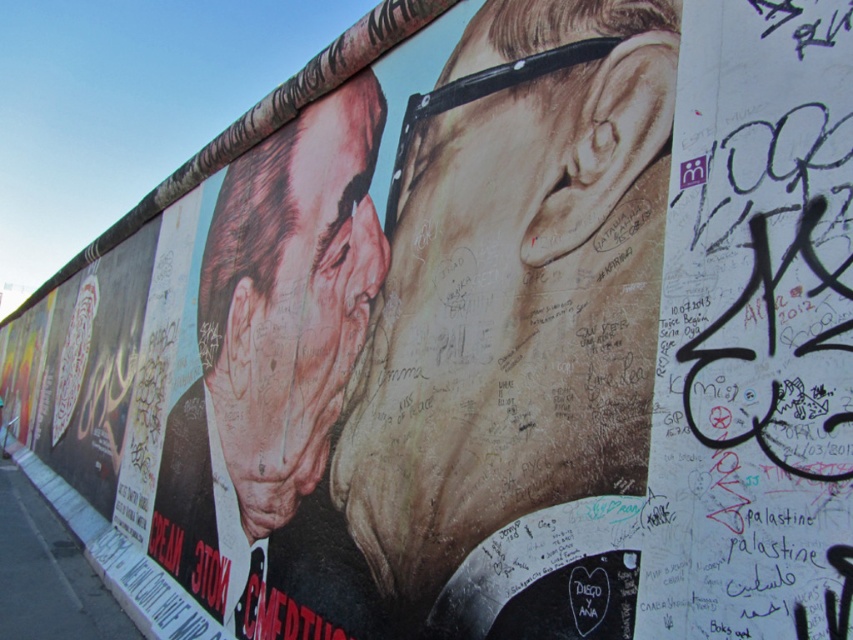
Question: Which point is farther to the camera?

Choices:
 (A) black graffiti at right
 (B) matte black face at left

Answer: (B)

Question: Which object is the farthest from the matte black face at left?

Choices:
 (A) black graffiti at right
 (B) matte brown face at center

Answer: (A)

Question: Considering the real-world distances, which object is closest to the black graffiti at right?

Choices:
 (A) matte black face at left
 (B) matte brown face at center

Answer: (B)

Question: Is matte brown face at center in front of matte black face at left?

Choices:
 (A) yes
 (B) no

Answer: (A)

Question: Does black graffiti at right have a lesser width compared to matte black face at left?

Choices:
 (A) no
 (B) yes

Answer: (B)

Question: Is matte brown face at center to the left of black graffiti at right from the viewer's perspective?

Choices:
 (A) yes
 (B) no

Answer: (A)